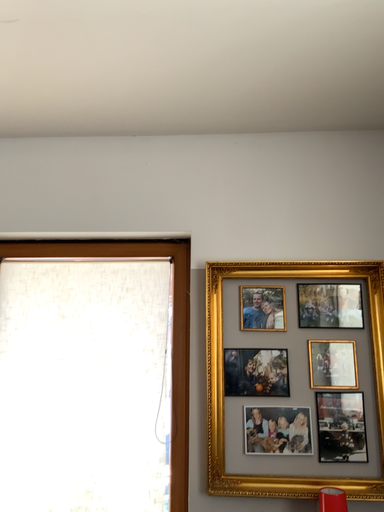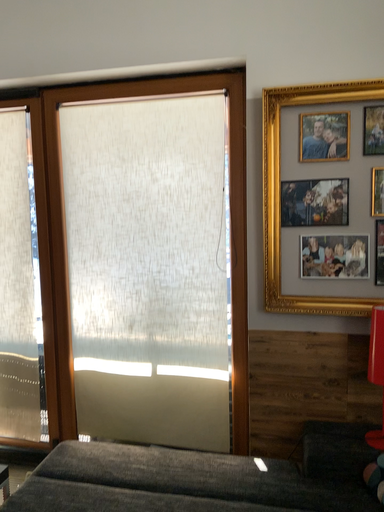
Question: Which way did the camera rotate in the video?

Choices:
 (A) rotated left
 (B) rotated right

Answer: (A)